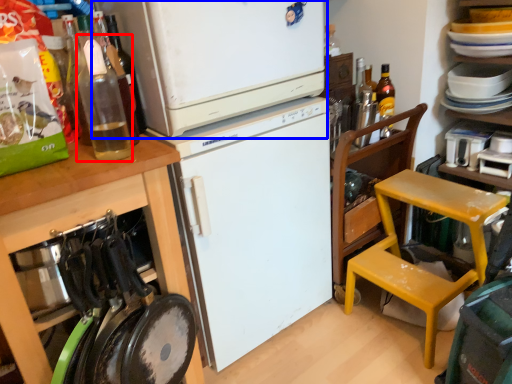
Question: Which point is closer to the camera, bottle (highlighted by a red box) or refrigerator (highlighted by a blue box)?

Choices:
 (A) bottle
 (B) refrigerator

Answer: (A)